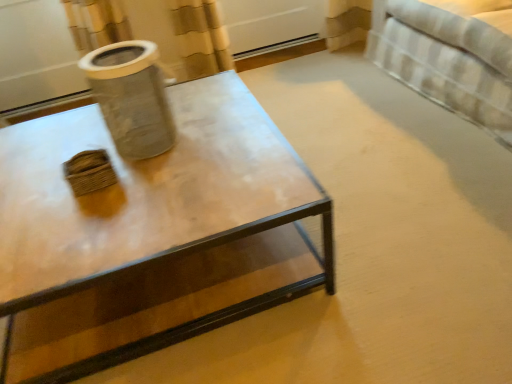
Question: Is matte glass coffee table at center positioned beyond the bounds of clear glass jar at upper left?

Choices:
 (A) yes
 (B) no

Answer: (A)

Question: Is matte glass coffee table at center positioned behind clear glass jar at upper left?

Choices:
 (A) no
 (B) yes

Answer: (A)

Question: Considering the relative positions of matte glass coffee table at center and clear glass jar at upper left in the image provided, is matte glass coffee table at center to the right of clear glass jar at upper left from the viewer's perspective?

Choices:
 (A) yes
 (B) no

Answer: (A)

Question: Is matte glass coffee table at center touching clear glass jar at upper left?

Choices:
 (A) yes
 (B) no

Answer: (B)

Question: Is matte glass coffee table at center surrounding clear glass jar at upper left?

Choices:
 (A) no
 (B) yes

Answer: (A)

Question: Is matte glass coffee table at center thinner than clear glass jar at upper left?

Choices:
 (A) yes
 (B) no

Answer: (B)

Question: Is the position of white striped fabric bed at upper right more distant than that of matte glass coffee table at center?

Choices:
 (A) no
 (B) yes

Answer: (B)

Question: Is white striped fabric bed at upper right facing towards matte glass coffee table at center?

Choices:
 (A) no
 (B) yes

Answer: (B)

Question: From the image's perspective, is white striped fabric bed at upper right on top of matte glass coffee table at center?

Choices:
 (A) yes
 (B) no

Answer: (A)

Question: Is white striped fabric bed at upper right to the left of matte glass coffee table at center from the viewer's perspective?

Choices:
 (A) no
 (B) yes

Answer: (A)

Question: Are white striped fabric bed at upper right and matte glass coffee table at center far apart?

Choices:
 (A) no
 (B) yes

Answer: (B)

Question: Is the position of white striped fabric bed at upper right less distant than that of matte glass coffee table at center?

Choices:
 (A) no
 (B) yes

Answer: (A)

Question: Does matte glass coffee table at center have a greater height compared to white striped fabric bed at upper right?

Choices:
 (A) yes
 (B) no

Answer: (B)